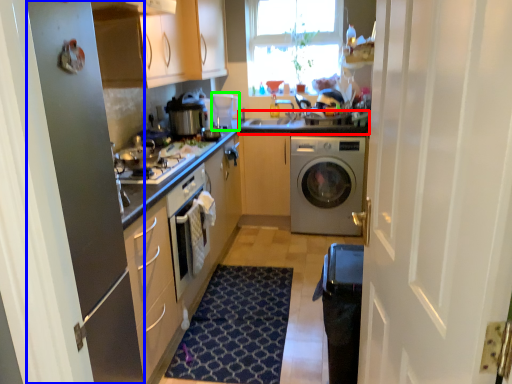
Question: Considering the real-world distances, which object is closest to counter top (highlighted by a red box)? screen door (highlighted by a blue box) or appliance (highlighted by a green box).

Choices:
 (A) screen door
 (B) appliance

Answer: (B)